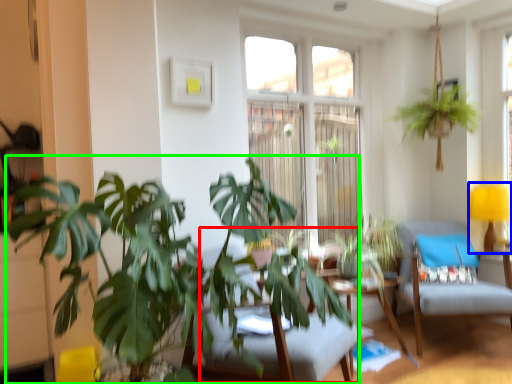
Question: Which object is the farthest from swivel chair (highlighted by a red box)? Choose among these: table lamp (highlighted by a blue box) or houseplant (highlighted by a green box).

Choices:
 (A) table lamp
 (B) houseplant

Answer: (A)